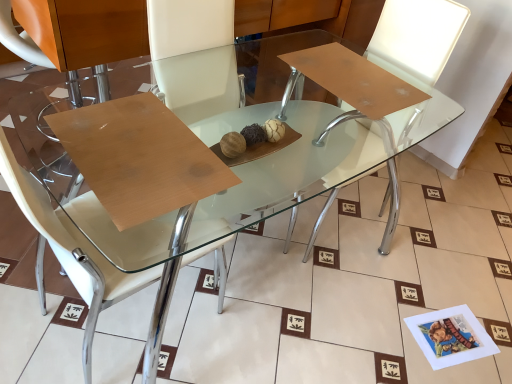
Question: Considering the positions of white leather chair at center, which is counted as the second chair, starting from the right, and white leather chair at center, which ranks as the first chair in right-to-left order, in the image, is white leather chair at center, which is counted as the second chair, starting from the right, bigger or smaller than white leather chair at center, which ranks as the first chair in right-to-left order,?

Choices:
 (A) big
 (B) small

Answer: (A)

Question: Looking at their shapes, would you say white leather chair at center, the first chair in the left-to-right sequence, is wider or thinner than white leather chair at center, acting as the 2th chair starting from the left?

Choices:
 (A) wide
 (B) thin

Answer: (B)

Question: Based on their relative distances, which object is nearer to the white leather chair at center, which ranks as the first chair in right-to-left order?

Choices:
 (A) white leather chair at center, the first chair in the left-to-right sequence
 (B) wooden at center

Answer: (B)

Question: Based on their relative distances, which object is farther from the white leather chair at center, the first chair in the left-to-right sequence?

Choices:
 (A) white leather chair at center, acting as the 2th chair starting from the left
 (B) wooden at center

Answer: (A)